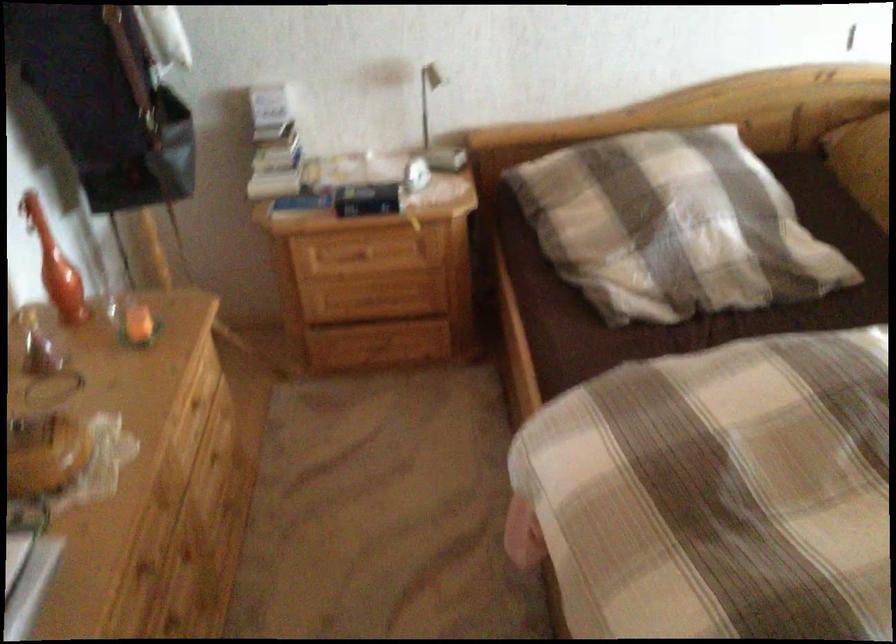
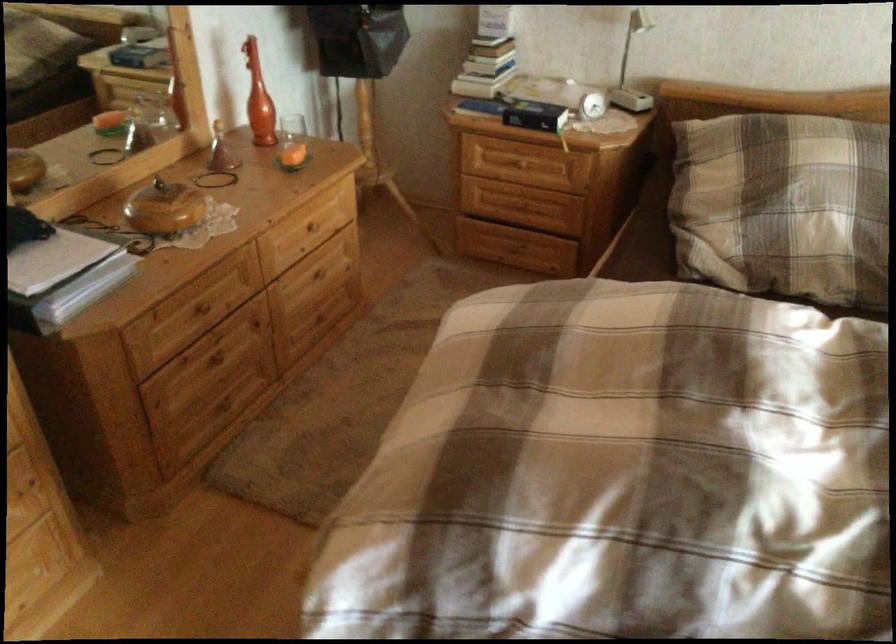
Find the pixel in the second image that matches point (432, 128) in the first image.

(632, 67)